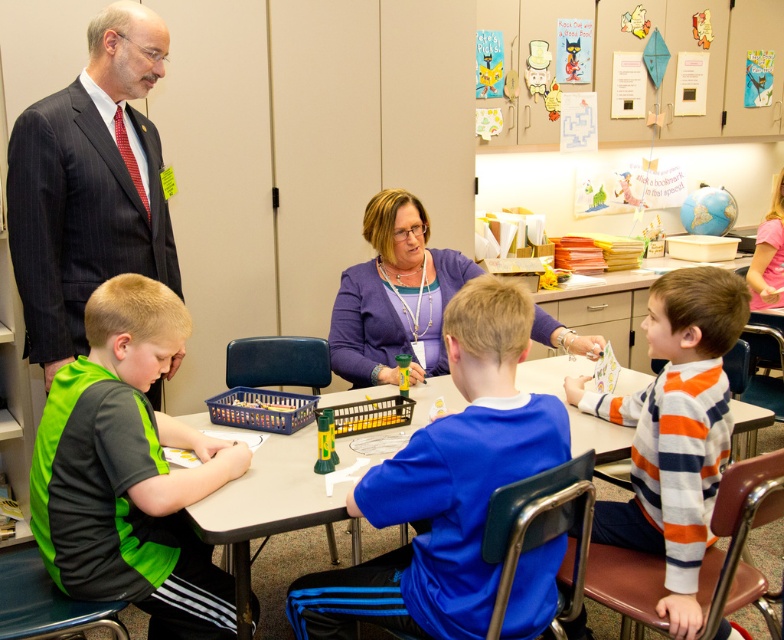
You are a teacher in the classroom. You need to determine which clothing item is shorter between the green jersey at lower left and the purple cardigan at upper center without measuring them. Based on their positions in the image, can you infer which one is shorter?

The green jersey at lower left is shorter than the purple cardigan at upper center.

You are a teacher standing at the back of the classroom. You need to hand out a worksheet to both the child wearing the blue jersey at center and the child wearing the purple cardigan at upper center. Which child should you approach first to ensure you reach them in the shortest path?

The blue jersey at center is closer to the viewer than the purple cardigan at upper center, so you should approach the child wearing the blue jersey at center first as they are nearer.

You are standing in the classroom and see the point at coordinates (445, 486). Which object from the following list is located at that point? The options are the small green and yellow tool, the black tray, or the blue jersey.

The point at coordinates (445, 486) is located on the blue jersey at center, so the correct answer is the blue jersey.